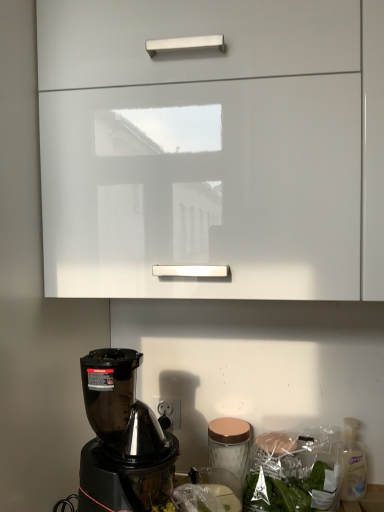
Question: Is clear plastic bottle at lower right facing away from white glossy cabinet at upper center?

Choices:
 (A) yes
 (B) no

Answer: (B)

Question: Is clear plastic bottle at lower right thinner than white glossy cabinet at upper center?

Choices:
 (A) yes
 (B) no

Answer: (A)

Question: Is clear plastic bottle at lower right far away from white glossy cabinet at upper center?

Choices:
 (A) no
 (B) yes

Answer: (A)

Question: From the image's perspective, does clear plastic bottle at lower right appear lower than white glossy cabinet at upper center?

Choices:
 (A) no
 (B) yes

Answer: (B)

Question: From the image's perspective, is clear plastic bottle at lower right on white glossy cabinet at upper center?

Choices:
 (A) no
 (B) yes

Answer: (A)

Question: From a real-world perspective, is clear plastic bottle at lower right positioned under white glossy cabinet at upper center based on gravity?

Choices:
 (A) no
 (B) yes

Answer: (B)

Question: From a real-world perspective, is white glossy cabinet at upper center under clear plastic bottle at lower right?

Choices:
 (A) no
 (B) yes

Answer: (A)

Question: From the image's perspective, does white glossy cabinet at upper center appear lower than clear plastic bottle at lower right?

Choices:
 (A) yes
 (B) no

Answer: (B)

Question: Would you say white glossy cabinet at upper center is a long distance from clear plastic bottle at lower right?

Choices:
 (A) no
 (B) yes

Answer: (A)

Question: Is white glossy cabinet at upper center outside clear plastic bottle at lower right?

Choices:
 (A) no
 (B) yes

Answer: (B)

Question: Is white glossy cabinet at upper center at the right side of clear plastic bottle at lower right?

Choices:
 (A) yes
 (B) no

Answer: (B)

Question: From a real-world perspective, is white glossy cabinet at upper center over clear plastic bottle at lower right?

Choices:
 (A) yes
 (B) no

Answer: (A)

Question: Is clear plastic bottle at lower right situated inside white glossy cabinet at upper center or outside?

Choices:
 (A) outside
 (B) inside

Answer: (A)